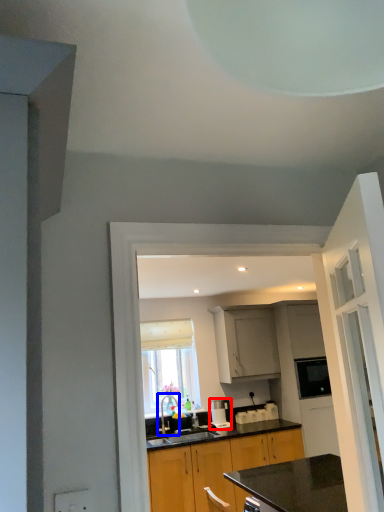
Question: Which point is closer to the camera, coffee machine (highlighted by a red box) or tap (highlighted by a blue box)?

Choices:
 (A) coffee machine
 (B) tap

Answer: (B)